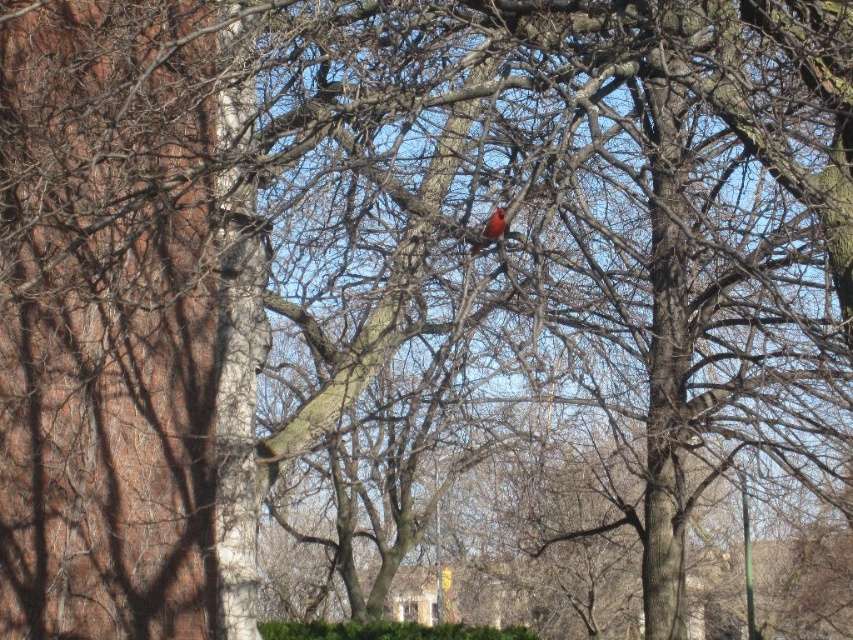
Question: Can you confirm if green leafy hedge at lower center is positioned to the right of bright red feathers at center?

Choices:
 (A) no
 (B) yes

Answer: (A)

Question: Which point is farther to the camera?

Choices:
 (A) green leafy hedge at lower center
 (B) bright red feathers at center

Answer: (A)

Question: Which object appears farthest from the camera in this image?

Choices:
 (A) green leafy hedge at lower center
 (B) bright red feathers at center

Answer: (A)

Question: Among these points, which one is nearest to the camera?

Choices:
 (A) (469, 248)
 (B) (370, 628)

Answer: (A)

Question: Can you confirm if green leafy hedge at lower center is positioned above bright red feathers at center?

Choices:
 (A) no
 (B) yes

Answer: (A)

Question: Can you confirm if green leafy hedge at lower center is positioned below bright red feathers at center?

Choices:
 (A) no
 (B) yes

Answer: (B)